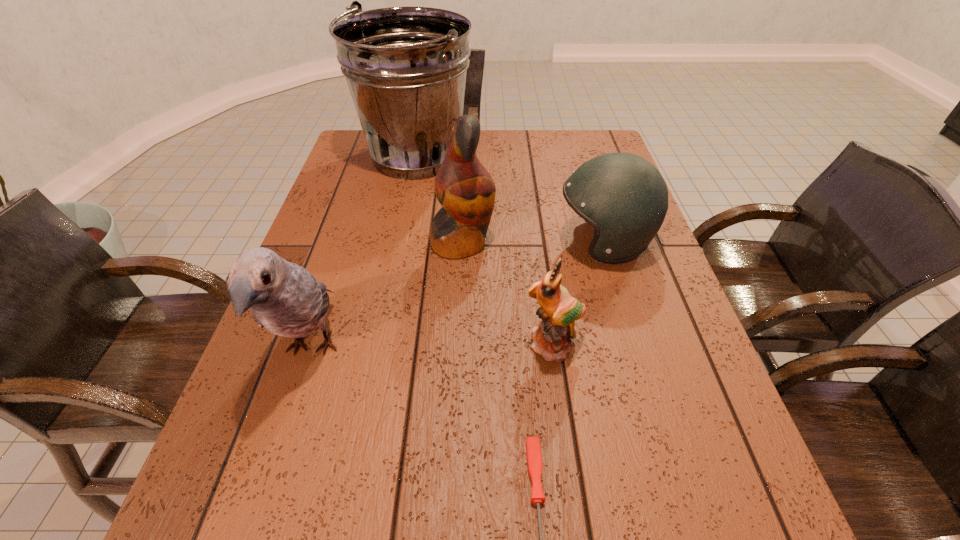
At what (x,y) coordinates should I click in order to perform the action: click on free spot located 0.080m on the front-facing side of the shortest parrot. Please return your answer as a coordinate pair (x, y). The height and width of the screenshot is (540, 960). Looking at the image, I should click on (561, 403).

Where is `free space located 0.170m at the face opening of the football helmet`? The width and height of the screenshot is (960, 540). free space located 0.170m at the face opening of the football helmet is located at coordinates (489, 242).

The width and height of the screenshot is (960, 540). I want to click on blank space located 0.270m at the face opening of the football helmet, so click(449, 242).

Image resolution: width=960 pixels, height=540 pixels. Identify the location of vacant area situated 0.350m at the face opening of the football helmet. (418, 242).

Locate an element on the screen. object present at the far edge is located at coordinates (406, 67).

The height and width of the screenshot is (540, 960). I want to click on bucket that is positioned at the left edge, so pos(406,67).

Identify the location of parrot present at the left edge. This screenshot has width=960, height=540. (285, 298).

Where is `object that is positioned at the right edge`? object that is positioned at the right edge is located at coordinates [624, 197].

Identify the location of object situated at the far left corner. The height and width of the screenshot is (540, 960). (406, 67).

What are the coordinates of `free space at the far edge of the desktop` in the screenshot? It's located at (545, 158).